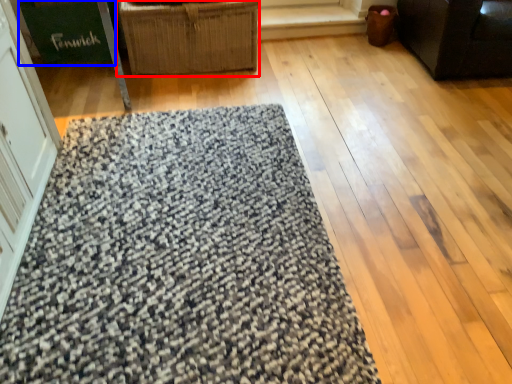
Question: Which point is closer to the camera, furniture (highlighted by a red box) or cardboard box (highlighted by a blue box)?

Choices:
 (A) furniture
 (B) cardboard box

Answer: (A)